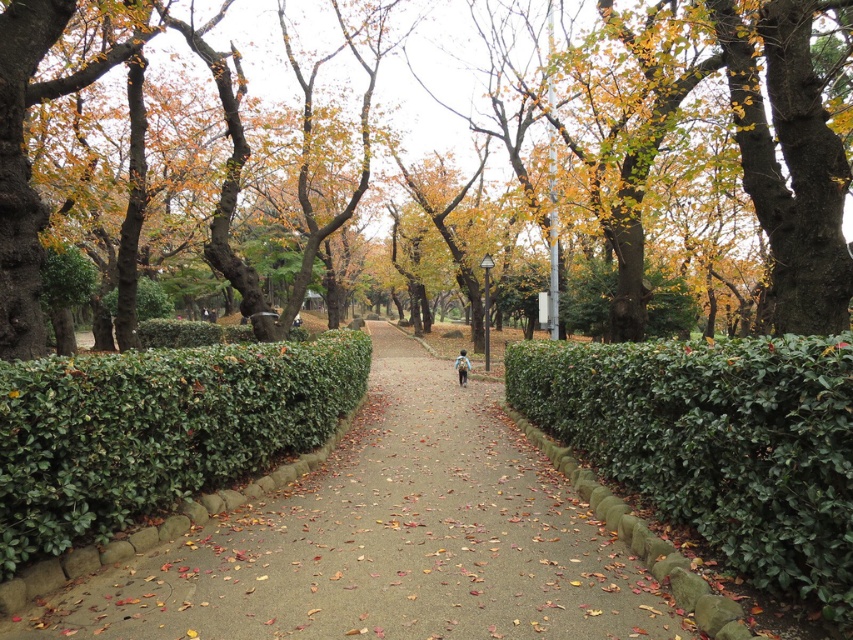
You are a gardener planning to trim both the green leafy hedge at right and the brown textured tree at center. Based on their sizes, which one would require more time and effort to trim?

The brown textured tree at center requires more time and effort to trim because it is larger than the green leafy hedge at right.

You are a hiker who wants to take a photo of the brown textured tree at center and the brown fabric backpack at center. Since you have a camera with a fixed focal length, you need to adjust your distance to ensure both objects are in frame. Given their sizes, which object should you move closer to or farther from to include both in your photo?

Since the brown textured tree at center is larger than the brown fabric backpack at center, you should move closer to the brown fabric backpack at center so that both objects appear balanced in size within the camera frame.